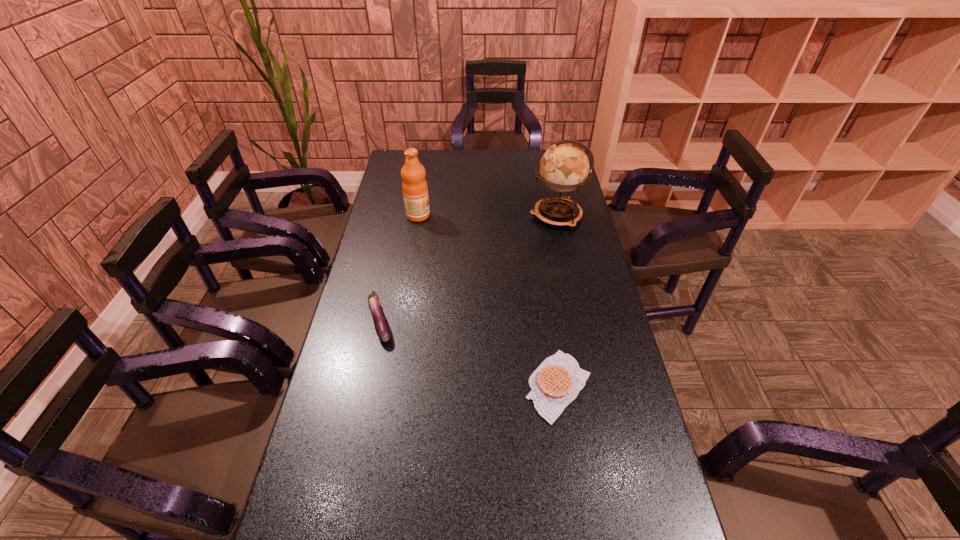
You are a GUI agent. You are given a task and a screenshot of the screen. Output one action in this format:
    pyautogui.click(x=<x>, y=<y>)
    Task: Click on the free spot located 0.170m on the front of the third tallest object
    The height and width of the screenshot is (540, 960).
    Given the screenshot: What is the action you would take?
    pyautogui.click(x=365, y=397)

In order to click on vacant region located on the left of the shortest object in this screenshot , I will do `click(426, 386)`.

Locate an element on the screen. The height and width of the screenshot is (540, 960). fruit juice present at the left edge is located at coordinates (415, 190).

Locate an element on the screen. This screenshot has width=960, height=540. eggplant that is at the left edge is located at coordinates 381,325.

You are a GUI agent. You are given a task and a screenshot of the screen. Output one action in this format:
    pyautogui.click(x=<x>, y=<y>)
    Task: Click on the globe that is at the right edge
    
    Given the screenshot: What is the action you would take?
    pyautogui.click(x=564, y=167)

Identify the location of pie positioned at the right edge. This screenshot has width=960, height=540. (557, 381).

Identify the location of blank area at the far edge. This screenshot has width=960, height=540. (439, 172).

Where is `vacant space at the left edge`? Image resolution: width=960 pixels, height=540 pixels. vacant space at the left edge is located at coordinates (353, 454).

This screenshot has width=960, height=540. I want to click on vacant space at the right edge, so click(x=587, y=273).

You are a GUI agent. You are given a task and a screenshot of the screen. Output one action in this format:
    pyautogui.click(x=<x>, y=<y>)
    Task: Click on the free space that is in between the third tallest object and the second tallest object
    
    Given the screenshot: What is the action you would take?
    pyautogui.click(x=399, y=268)